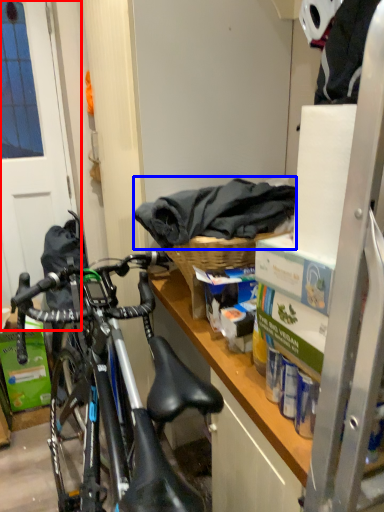
Question: Among these objects, which one is nearest to the camera, screen door (highlighted by a red box) or material (highlighted by a blue box)?

Choices:
 (A) screen door
 (B) material

Answer: (B)